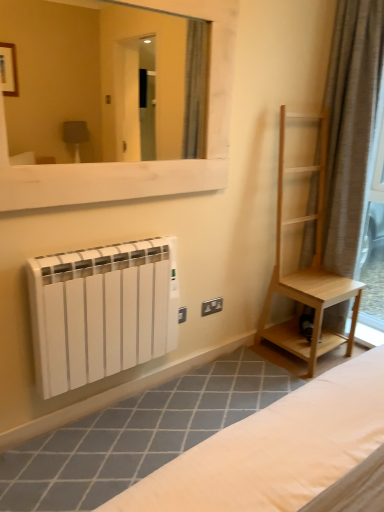
Question: Is white matte radiator at lower left positioned with its back to white wooden mirror at upper center?

Choices:
 (A) no
 (B) yes

Answer: (A)

Question: Can you confirm if white matte radiator at lower left is wider than white wooden mirror at upper center?

Choices:
 (A) no
 (B) yes

Answer: (B)

Question: Does white matte radiator at lower left have a lesser height compared to white wooden mirror at upper center?

Choices:
 (A) no
 (B) yes

Answer: (B)

Question: Considering the relative sizes of white matte radiator at lower left and white wooden mirror at upper center in the image provided, is white matte radiator at lower left bigger than white wooden mirror at upper center?

Choices:
 (A) yes
 (B) no

Answer: (B)

Question: Is white matte radiator at lower left outside of white wooden mirror at upper center?

Choices:
 (A) no
 (B) yes

Answer: (B)

Question: Would you say black plastic electric outlet at lower center is inside or outside white matte radiator at lower left?

Choices:
 (A) inside
 (B) outside

Answer: (B)

Question: From a real-world perspective, is black plastic electric outlet at lower center physically located above or below white matte radiator at lower left?

Choices:
 (A) below
 (B) above

Answer: (A)

Question: Is point (215, 301) closer or farther from the camera than point (64, 360)?

Choices:
 (A) farther
 (B) closer

Answer: (A)

Question: Is black plastic electric outlet at lower center bigger or smaller than white matte radiator at lower left?

Choices:
 (A) small
 (B) big

Answer: (A)

Question: From a real-world perspective, relative to black plastic electric outlet at lower center, is white wooden mirror at upper center vertically above or below?

Choices:
 (A) above
 (B) below

Answer: (A)

Question: Considering the positions of white wooden mirror at upper center and black plastic electric outlet at lower center in the image, is white wooden mirror at upper center bigger or smaller than black plastic electric outlet at lower center?

Choices:
 (A) big
 (B) small

Answer: (A)

Question: From the image's perspective, is white wooden mirror at upper center located above or below black plastic electric outlet at lower center?

Choices:
 (A) below
 (B) above

Answer: (B)

Question: Considering the positions of white wooden mirror at upper center and black plastic electric outlet at lower center in the image, is white wooden mirror at upper center wider or thinner than black plastic electric outlet at lower center?

Choices:
 (A) wide
 (B) thin

Answer: (A)

Question: Is brown textured curtain at right in front of or behind white matte radiator at lower left in the image?

Choices:
 (A) behind
 (B) front

Answer: (A)

Question: Considering the positions of brown textured curtain at right and white matte radiator at lower left in the image, is brown textured curtain at right taller or shorter than white matte radiator at lower left?

Choices:
 (A) short
 (B) tall

Answer: (B)